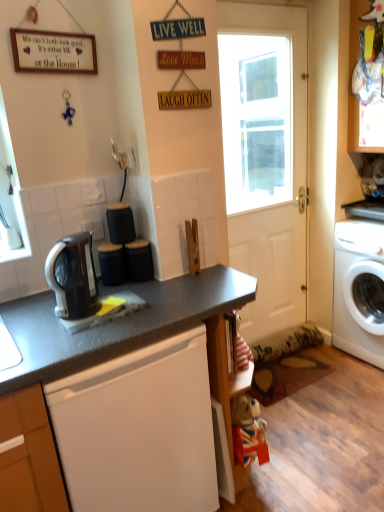
Question: Does white glossy washing machine at right turn towards black glossy coffee maker at left?

Choices:
 (A) no
 (B) yes

Answer: (B)

Question: Is white glossy washing machine at right oriented away from black glossy coffee maker at left?

Choices:
 (A) no
 (B) yes

Answer: (A)

Question: From a real-world perspective, is white glossy washing machine at right physically below black glossy coffee maker at left?

Choices:
 (A) no
 (B) yes

Answer: (B)

Question: Is white glossy washing machine at right at the right side of black glossy coffee maker at left?

Choices:
 (A) no
 (B) yes

Answer: (B)

Question: Is white glossy washing machine at right beside black glossy coffee maker at left?

Choices:
 (A) yes
 (B) no

Answer: (B)

Question: Is black glossy coffee maker at left bigger or smaller than white glossy washing machine at right?

Choices:
 (A) big
 (B) small

Answer: (B)

Question: Relative to white glossy washing machine at right, is black glossy coffee maker at left in front or behind?

Choices:
 (A) behind
 (B) front

Answer: (B)

Question: From the image's perspective, is black glossy coffee maker at left positioned above or below white glossy washing machine at right?

Choices:
 (A) above
 (B) below

Answer: (A)

Question: Is point (61, 311) closer or farther from the camera than point (382, 269)?

Choices:
 (A) farther
 (B) closer

Answer: (B)

Question: Is black glossy coffee maker at left to the left or to the right of matte black coffee maker at center, the 1th appliance positioned from the left, in the image?

Choices:
 (A) left
 (B) right

Answer: (A)

Question: From the image's perspective, is black glossy coffee maker at left above or below matte black coffee maker at center, the 1th appliance positioned from the left?

Choices:
 (A) below
 (B) above

Answer: (A)

Question: Looking at their shapes, would you say black glossy coffee maker at left is wider or thinner than matte black coffee maker at center, the 1th appliance positioned from the left?

Choices:
 (A) thin
 (B) wide

Answer: (B)

Question: Is black glossy coffee maker at left in front of or behind matte black coffee maker at center, which is counted as the second appliance, starting from the right, in the image?

Choices:
 (A) front
 (B) behind

Answer: (A)

Question: Does point (117, 275) appear closer or farther from the camera than point (264, 195)?

Choices:
 (A) farther
 (B) closer

Answer: (B)

Question: In terms of width, does matte black coffee maker at center, the 1th appliance positioned from the left, look wider or thinner when compared to white matte door at center?

Choices:
 (A) thin
 (B) wide

Answer: (B)